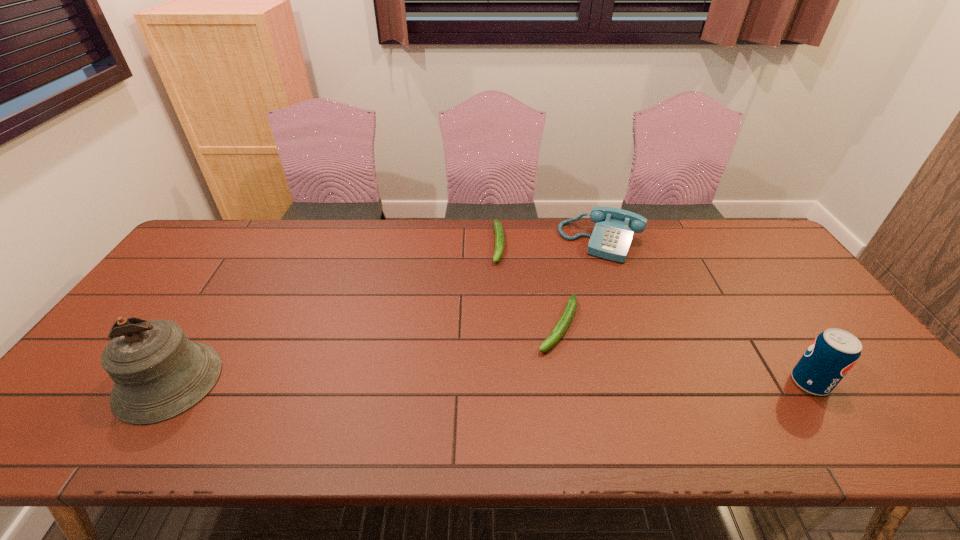
Locate an element on the screen. The height and width of the screenshot is (540, 960). vacant area at the far left corner is located at coordinates (198, 245).

You are a GUI agent. You are given a task and a screenshot of the screen. Output one action in this format:
    pyautogui.click(x=<x>, y=<y>)
    Task: Click on the vacant space at the far right corner of the desktop
    
    Given the screenshot: What is the action you would take?
    pyautogui.click(x=767, y=262)

I want to click on vacant area that lies between the telephone and the right zucchini, so click(x=580, y=284).

This screenshot has width=960, height=540. Identify the location of free area in between the pop and the farther zucchini. (654, 313).

In order to click on vacant space that's between the farther zucchini and the telephone in this screenshot , I will do `click(549, 243)`.

The width and height of the screenshot is (960, 540). Find the location of `free space that is in between the farther zucchini and the rightmost object`. free space that is in between the farther zucchini and the rightmost object is located at coordinates (654, 313).

The width and height of the screenshot is (960, 540). I want to click on vacant point located between the third tallest object and the nearer zucchini, so click(x=580, y=284).

The image size is (960, 540). Identify the location of vacant space that is in between the nearer zucchini and the third tallest object. (580, 284).

Locate an element on the screen. The height and width of the screenshot is (540, 960). blank region between the nearer zucchini and the tallest object is located at coordinates (364, 354).

Where is `vacant region between the fourth object from right to left and the right zucchini`? This screenshot has width=960, height=540. vacant region between the fourth object from right to left and the right zucchini is located at coordinates (528, 285).